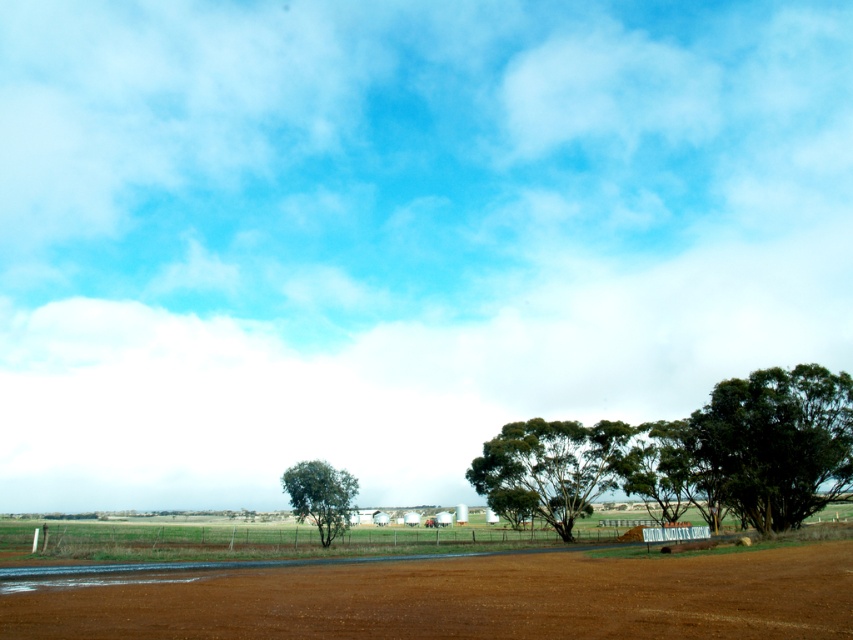
You are standing at the bottom left of the dirt road in the rural landscape. You want to walk to the point marked as point (210, 573) and then to point (741, 444). Which point will you reach first?

You will reach point (210, 573) first because it is closer to you than point (741, 444).

You are standing on the dirt road in the foreground of the scene. You want to walk to the green leafy tree at right. Which direction should you walk to reach it while staying on the path closest to the brown dirt field at center?

You should walk towards the center right along the dirt road, as the brown dirt field at center is in front of the green leafy tree at right, meaning the tree is behind the field relative to your position on the road. By following the road towards the center right, you will approach the area near the field and then have access to the tree.